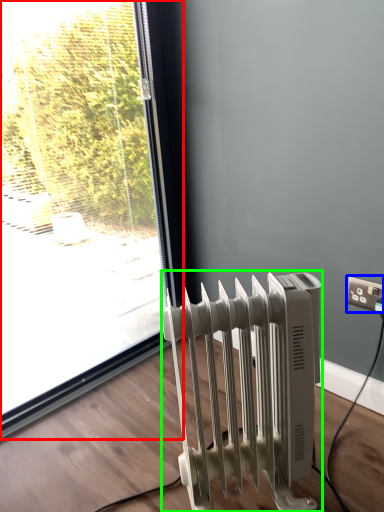
Question: Which is nearer to the window (highlighted by a red box)? electric outlet (highlighted by a blue box) or radiator (highlighted by a green box).

Choices:
 (A) electric outlet
 (B) radiator

Answer: (B)